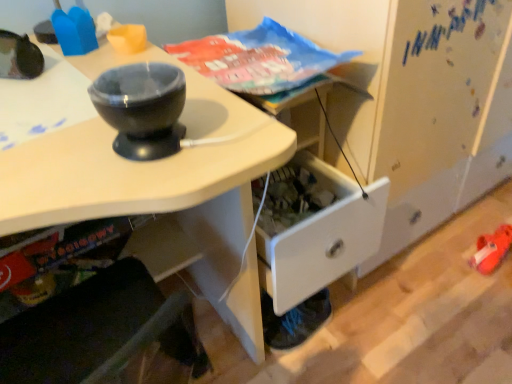
The width and height of the screenshot is (512, 384). Identify the location of vacant position to the left of blue fabric shoe at lower right. (229, 351).